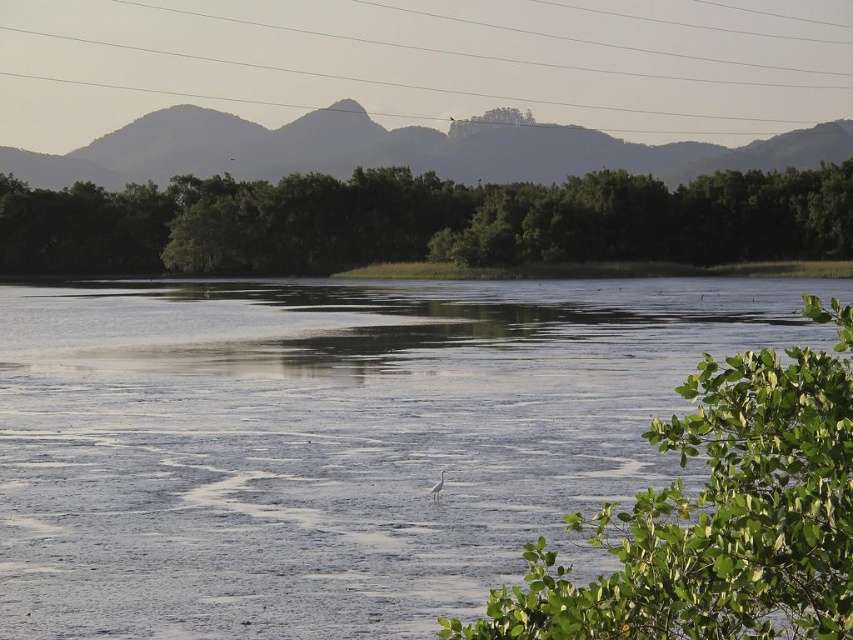
Question: Does clear water at center appear on the right side of green leafy trees at center?

Choices:
 (A) no
 (B) yes

Answer: (B)

Question: Which object is positioned farthest from the green leafy trees at center?

Choices:
 (A) smooth wire at upper center
 (B) silvery gray mountain at upper center
 (C) clear water at center
 (D) green leafy tree at lower right

Answer: (D)

Question: Which object is closer to the camera taking this photo?

Choices:
 (A) green leafy tree at lower right
 (B) green leafy trees at center
 (C) smooth wire at upper center

Answer: (A)

Question: From the image, what is the correct spatial relationship of smooth wire at upper center in relation to green leafy tree at lower right?

Choices:
 (A) right
 (B) left

Answer: (B)

Question: Which of the following is the closest to the observer?

Choices:
 (A) (740, 184)
 (B) (630, 611)

Answer: (B)

Question: Can you confirm if clear water at center is positioned to the right of silvery gray mountain at upper center?

Choices:
 (A) no
 (B) yes

Answer: (A)